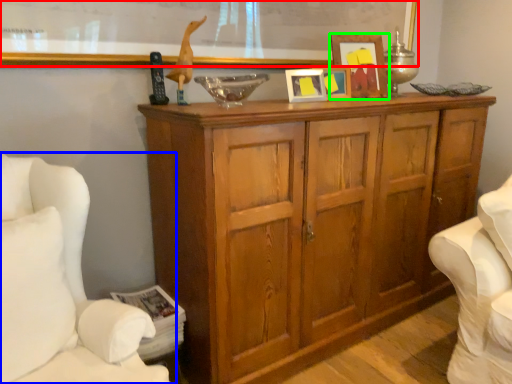
Question: Estimate the real-world distances between objects in this image. Which object is farther from bulletin board (highlighted by a red box), furniture (highlighted by a blue box) or picture frame (highlighted by a green box)?

Choices:
 (A) furniture
 (B) picture frame

Answer: (A)